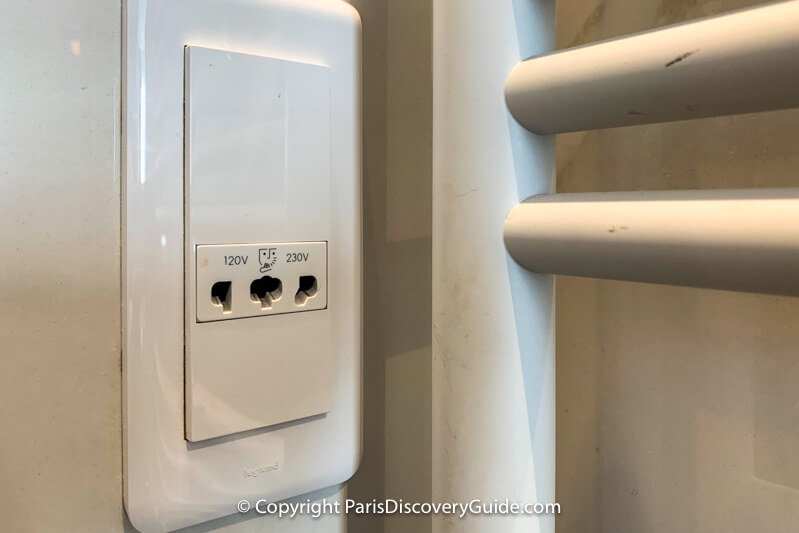
This screenshot has height=533, width=799. I want to click on wall, so click(x=710, y=426).